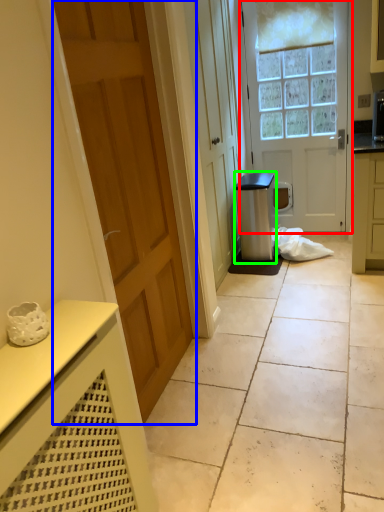
Question: Which object is positioned farthest from door (highlighted by a red box)? Select from door (highlighted by a blue box) and appliance (highlighted by a green box).

Choices:
 (A) door
 (B) appliance

Answer: (A)